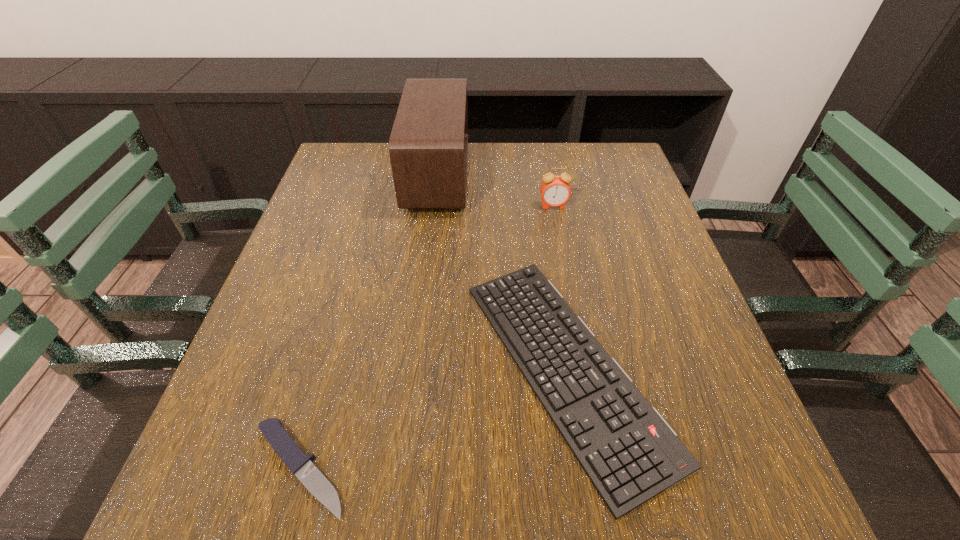
Identify the location of steak knife located in the near edge section of the desktop. (301, 465).

Image resolution: width=960 pixels, height=540 pixels. In order to click on object that is at the left edge in this screenshot , I will do `click(301, 465)`.

The image size is (960, 540). What are the coordinates of `object located in the right edge section of the desktop` in the screenshot? It's located at (629, 452).

Identify the location of object positioned at the near left corner. This screenshot has width=960, height=540. (301, 465).

Image resolution: width=960 pixels, height=540 pixels. I want to click on object at the near right corner, so click(629, 452).

You are a GUI agent. You are given a task and a screenshot of the screen. Output one action in this format:
    pyautogui.click(x=<x>, y=<y>)
    Task: Click on the vacant region at the far edge of the desktop
    
    Given the screenshot: What is the action you would take?
    pyautogui.click(x=522, y=160)

Image resolution: width=960 pixels, height=540 pixels. What are the coordinates of `free space at the near edge of the desktop` in the screenshot? It's located at (335, 516).

This screenshot has height=540, width=960. What are the coordinates of `vacant space at the left edge of the desktop` in the screenshot? It's located at (327, 381).

Identify the location of free location at the right edge of the desktop. (622, 197).

The image size is (960, 540). Find the location of `vacant region at the far left corner of the desktop`. vacant region at the far left corner of the desktop is located at coordinates (368, 157).